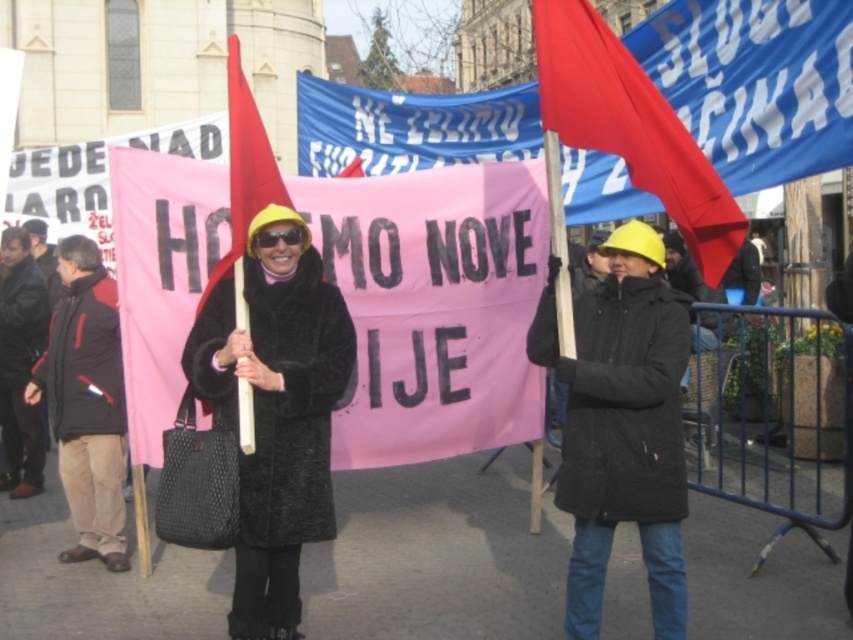
You are a photographer trying to capture the protest scene. You notice a point at coordinates (276, 410). What object is located at this point?

The point at coordinates (276, 410) corresponds to the velvet black coat at center.

What are the coordinates of the matte red flag at upper right in the image?

The coordinates of the matte red flag at upper right are point (x=630, y=125).

You are a photographer standing at the center of the protest scene. You want to take a photo that includes both the matte red flag at upper right and the black leather jacket at left. Given that your camera has a maximum focal length that allows capturing objects up to 12 meters apart, will you be able to include both in the same frame?

The matte red flag at upper right is 13.09 meters from the black leather jacket at left. Since the distance exceeds the camera maximum focal length of 12 meters, you cannot include both in the same frame.